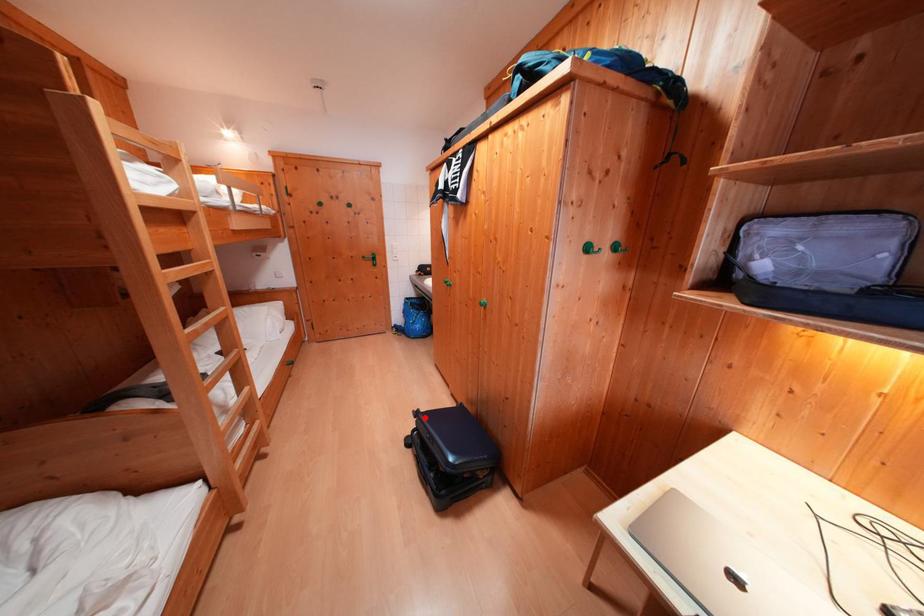
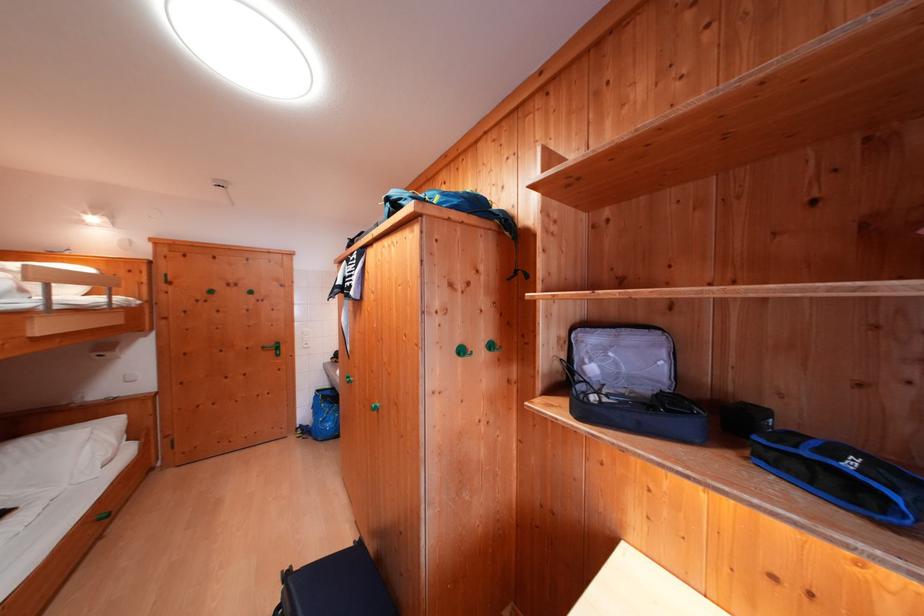
Question: A red point is marked in image1. In image2, is the corresponding 3D point closer to the camera or farther? Reply with the corresponding letter.

Choices:
 (A) The corresponding 3D point is closer.
 (B) The corresponding 3D point is farther.

Answer: (B)